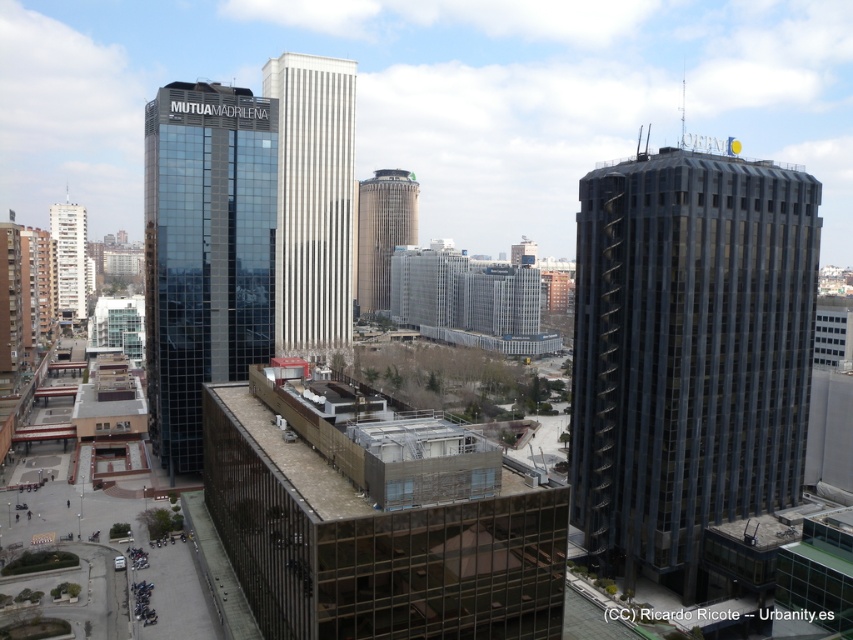
You are standing at the center of the city square. You see the dark gray glass building at center. Where is it located in terms of coordinates?

The dark gray glass building at center is located at coordinates point (688, 355).

Consider the image. You are a drone operator who needs to deliver a package to a rooftop garden. The drone has a maximum flight altitude of 100 meters. According to the scene, is the point at coordinates point (688, 355) reachable by your drone?

The point at coordinates point (688, 355) is located at the dark gray glass building at center, which is a tall building. Since the drone has a maximum flight altitude of 100 meters, it can reach the rooftop garden at that point if the building is within the altitude limit. However, the exact height of the building isn